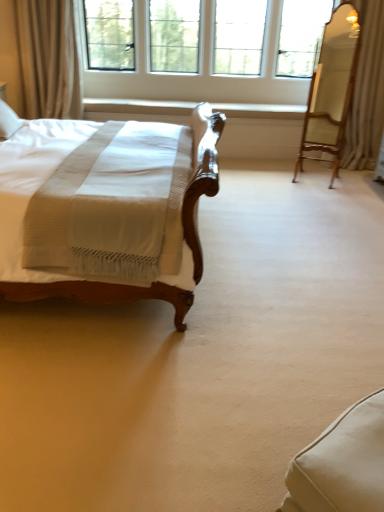
Describe the element at coordinates (341, 464) in the screenshot. The height and width of the screenshot is (512, 384). I see `white fabric swivel chair at lower right, which is the 1th swivel chair from front to back` at that location.

Locate an element on the screen. This screenshot has width=384, height=512. clear glass window at upper center is located at coordinates (202, 49).

In the image, is white textured curtain at upper right, which appears as the first curtain when viewed from the right, positioned in front of or behind white fabric swivel chair at lower right, which is the 1th swivel chair from front to back?

Clearly, white textured curtain at upper right, which appears as the first curtain when viewed from the right, is behind white fabric swivel chair at lower right, which is the 1th swivel chair from front to back.

Considering the relative sizes of white textured curtain at upper right, the second curtain from the left, and white fabric swivel chair at lower right, positioned as the first swivel chair in bottom-to-top order, in the image provided, is white textured curtain at upper right, the second curtain from the left, wider than white fabric swivel chair at lower right, positioned as the first swivel chair in bottom-to-top order,?

Correct, the width of white textured curtain at upper right, the second curtain from the left, exceeds that of white fabric swivel chair at lower right, positioned as the first swivel chair in bottom-to-top order.

Can you confirm if white textured curtain at upper right, which appears as the first curtain when viewed from the right, is taller than white fabric swivel chair at lower right, which is the 1th swivel chair from front to back?

Yes.

Which of these two, beige fabric curtain at upper left, the second curtain viewed from the right, or white textured curtain at upper right, the second curtain from the left, is thinner?

beige fabric curtain at upper left, the second curtain viewed from the right.

Consider the image. From a real-world perspective, relative to white textured curtain at upper right, the second curtain from the left, is beige fabric curtain at upper left, arranged as the 1th curtain when viewed from the left, vertically above or below?

beige fabric curtain at upper left, arranged as the 1th curtain when viewed from the left, is above white textured curtain at upper right, the second curtain from the left.

Is beige fabric curtain at upper left, arranged as the 1th curtain when viewed from the left, touching white textured curtain at upper right, the second curtain from the left?

There is a gap between beige fabric curtain at upper left, arranged as the 1th curtain when viewed from the left, and white textured curtain at upper right, the second curtain from the left.

The height and width of the screenshot is (512, 384). Find the location of `curtain in front of the beige fabric curtain at upper left, the second curtain viewed from the right`. curtain in front of the beige fabric curtain at upper left, the second curtain viewed from the right is located at coordinates (367, 91).

Would you say white fabric swivel chair at lower right, marked as the second swivel chair in a back-to-front arrangement, is outside clear glass window at upper center?

That's correct, white fabric swivel chair at lower right, marked as the second swivel chair in a back-to-front arrangement, is outside of clear glass window at upper center.

Considering their positions, is white fabric swivel chair at lower right, which is the second swivel chair from top to bottom, located in front of or behind clear glass window at upper center?

white fabric swivel chair at lower right, which is the second swivel chair from top to bottom, is in front of clear glass window at upper center.

Measure the distance between white fabric swivel chair at lower right, positioned as the first swivel chair in bottom-to-top order, and clear glass window at upper center.

15.58 feet.

Which of these two, white fabric swivel chair at lower right, positioned as the first swivel chair in bottom-to-top order, or clear glass window at upper center, is wider?

With larger width is clear glass window at upper center.

Which object is thinner, clear glass window at upper center or wooden swivel chair at right, which is counted as the second swivel chair, starting from the bottom?

Thinner between the two is wooden swivel chair at right, which is counted as the second swivel chair, starting from the bottom.

Is wooden swivel chair at right, marked as the first swivel chair in a back-to-front arrangement, a part of clear glass window at upper center?

No, wooden swivel chair at right, marked as the first swivel chair in a back-to-front arrangement, is not a part of clear glass window at upper center.

Is clear glass window at upper center to the right of wooden swivel chair at right, marked as the first swivel chair in a back-to-front arrangement, from the viewer's perspective?

No.

What's the angular difference between wooden swivel chair at right, the 2th swivel chair in the front-to-back sequence, and white textured curtain at upper right, which appears as the first curtain when viewed from the right,'s facing directions?

The angular difference between wooden swivel chair at right, the 2th swivel chair in the front-to-back sequence, and white textured curtain at upper right, which appears as the first curtain when viewed from the right, is 64.4 degrees.

Is wooden swivel chair at right, which ranks as the first swivel chair in top-to-bottom order, positioned far away from white textured curtain at upper right, which appears as the first curtain when viewed from the right?

wooden swivel chair at right, which ranks as the first swivel chair in top-to-bottom order, is actually quite close to white textured curtain at upper right, which appears as the first curtain when viewed from the right.

Based on the photo, is wooden swivel chair at right, marked as the first swivel chair in a back-to-front arrangement, oriented away from white textured curtain at upper right, the second curtain from the left?

Absolutely, wooden swivel chair at right, marked as the first swivel chair in a back-to-front arrangement, is directed away from white textured curtain at upper right, the second curtain from the left.

From a real-world perspective, which is physically above, wooden swivel chair at right, marked as the first swivel chair in a back-to-front arrangement, or white textured curtain at upper right, the second curtain from the left?

white textured curtain at upper right, the second curtain from the left, from a real-world perspective.

Is clear glass window at upper center aimed at white textured curtain at upper right, the second curtain from the left?

No.

From a real-world perspective, does clear glass window at upper center sit lower than white textured curtain at upper right, which appears as the first curtain when viewed from the right?

Incorrect, from a real-world perspective, clear glass window at upper center is higher than white textured curtain at upper right, which appears as the first curtain when viewed from the right.

Would you say clear glass window at upper center is inside or outside white textured curtain at upper right, which appears as the first curtain when viewed from the right?

clear glass window at upper center exists outside the volume of white textured curtain at upper right, which appears as the first curtain when viewed from the right.

How far apart are clear glass window at upper center and white textured curtain at upper right, which appears as the first curtain when viewed from the right?

clear glass window at upper center is 4.90 feet from white textured curtain at upper right, which appears as the first curtain when viewed from the right.

Looking at this image, can you confirm if white textured curtain at upper right, the second curtain from the left, is smaller than wooden swivel chair at right, the 2th swivel chair in the front-to-back sequence?

No.

In the image, is white textured curtain at upper right, which appears as the first curtain when viewed from the right, on the left side or the right side of wooden swivel chair at right, the 2th swivel chair in the front-to-back sequence?

From the image, it's evident that white textured curtain at upper right, which appears as the first curtain when viewed from the right, is to the right of wooden swivel chair at right, the 2th swivel chair in the front-to-back sequence.

Which of these two, white textured curtain at upper right, which appears as the first curtain when viewed from the right, or wooden swivel chair at right, which appears as the 2th swivel chair when viewed from the left, is thinner?

wooden swivel chair at right, which appears as the 2th swivel chair when viewed from the left.

Find the location of a particular element. The height and width of the screenshot is (512, 384). swivel chair that is the 2nd object to the left of the white textured curtain at upper right, the second curtain from the left, starting at the anchor is located at coordinates (341, 464).

You are a GUI agent. You are given a task and a screenshot of the screen. Output one action in this format:
    pyautogui.click(x=<x>, y=<y>)
    Task: Click on the curtain in front of the beige fabric curtain at upper left, the second curtain viewed from the right
    This screenshot has height=512, width=384.
    Given the screenshot: What is the action you would take?
    pyautogui.click(x=367, y=91)

Estimate the real-world distances between objects in this image. Which object is closer to clear glass window at upper center, beige fabric curtain at upper left, arranged as the 1th curtain when viewed from the left, or wooden swivel chair at right, the 2th swivel chair in the front-to-back sequence?

Among the two, wooden swivel chair at right, the 2th swivel chair in the front-to-back sequence, is located nearer to clear glass window at upper center.

Considering their positions, is white textured curtain at upper right, the second curtain from the left, positioned closer to wooden swivel chair at right, which ranks as the first swivel chair in top-to-bottom order, than beige fabric curtain at upper left, arranged as the 1th curtain when viewed from the left?

white textured curtain at upper right, the second curtain from the left, is positioned closer to the anchor wooden swivel chair at right, which ranks as the first swivel chair in top-to-bottom order.

Estimate the real-world distances between objects in this image. Which object is further from clear glass window at upper center, wooden swivel chair at right, which ranks as the first swivel chair in top-to-bottom order, or white fabric swivel chair at lower right, positioned as the first swivel chair in bottom-to-top order?

white fabric swivel chair at lower right, positioned as the first swivel chair in bottom-to-top order.

Considering their positions, is clear glass window at upper center positioned closer to wooden swivel chair at right, which appears as the 2th swivel chair when viewed from the left, than beige fabric curtain at upper left, arranged as the 1th curtain when viewed from the left?

The object closer to wooden swivel chair at right, which appears as the 2th swivel chair when viewed from the left, is clear glass window at upper center.

Based on their spatial positions, is clear glass window at upper center or wooden swivel chair at right, marked as the first swivel chair in a back-to-front arrangement, further from white fabric swivel chair at lower right, which is the 1th swivel chair from front to back?

The object further to white fabric swivel chair at lower right, which is the 1th swivel chair from front to back, is clear glass window at upper center.

Which object lies nearer to the anchor point wooden swivel chair at right, which is counted as the second swivel chair, starting from the bottom, beige fabric curtain at upper left, the second curtain viewed from the right, or white textured curtain at upper right, which appears as the first curtain when viewed from the right?

white textured curtain at upper right, which appears as the first curtain when viewed from the right, is positioned closer to the anchor wooden swivel chair at right, which is counted as the second swivel chair, starting from the bottom.

Based on their spatial positions, is white fabric swivel chair at lower right, which is the 1th swivel chair from front to back, or clear glass window at upper center closer to white textured curtain at upper right, the second curtain from the left?

The object closer to white textured curtain at upper right, the second curtain from the left, is clear glass window at upper center.

Consider the image. Estimate the real-world distances between objects in this image. Which object is further from beige fabric curtain at upper left, arranged as the 1th curtain when viewed from the left, wooden swivel chair at right, which is counted as the second swivel chair, starting from the bottom, or white textured curtain at upper right, the second curtain from the left?

Based on the image, white textured curtain at upper right, the second curtain from the left, appears to be further to beige fabric curtain at upper left, arranged as the 1th curtain when viewed from the left.

This screenshot has width=384, height=512. I want to click on window between beige fabric curtain at upper left, arranged as the 1th curtain when viewed from the left, and wooden swivel chair at right, which is counted as the second swivel chair, starting from the bottom, in the horizontal direction, so click(x=202, y=49).

The width and height of the screenshot is (384, 512). Identify the location of window between beige fabric curtain at upper left, arranged as the 1th curtain when viewed from the left, and white textured curtain at upper right, which appears as the first curtain when viewed from the right. pyautogui.click(x=202, y=49).

This screenshot has height=512, width=384. Find the location of `swivel chair between white fabric swivel chair at lower right, marked as the second swivel chair in a back-to-front arrangement, and beige fabric curtain at upper left, the second curtain viewed from the right, in the front-back direction`. swivel chair between white fabric swivel chair at lower right, marked as the second swivel chair in a back-to-front arrangement, and beige fabric curtain at upper left, the second curtain viewed from the right, in the front-back direction is located at coordinates (331, 88).

Locate an element on the screen. swivel chair between white fabric swivel chair at lower right, positioned as the first swivel chair in bottom-to-top order, and white textured curtain at upper right, the second curtain from the left, along the z-axis is located at coordinates (331, 88).